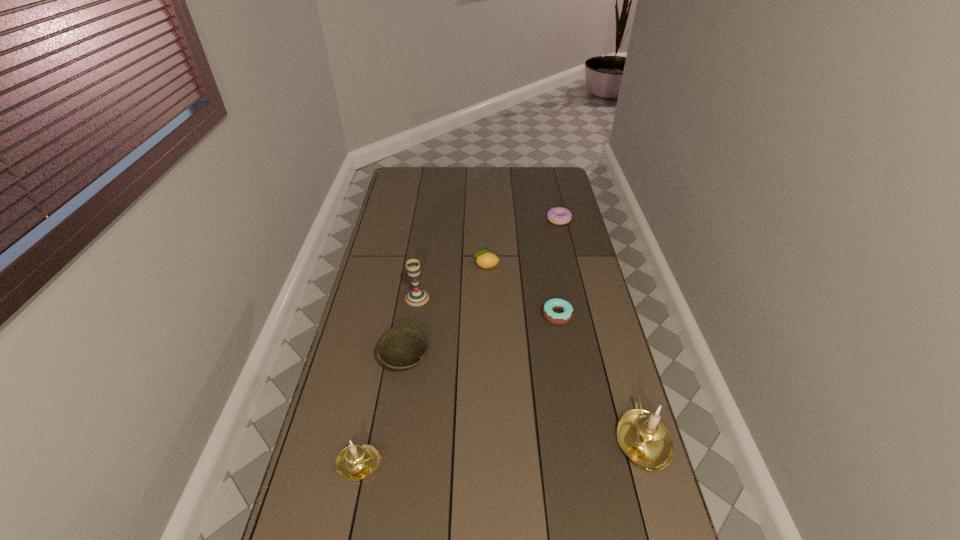
Locate an element on the screen. Image resolution: width=960 pixels, height=540 pixels. the third closest object relative to the shorter doughnut is located at coordinates (403, 347).

At what (x,y) coordinates should I click in order to perform the action: click on object that is the third nearest to the second shortest object. Please return your answer as a coordinate pair (x, y). The height and width of the screenshot is (540, 960). Looking at the image, I should click on (417, 297).